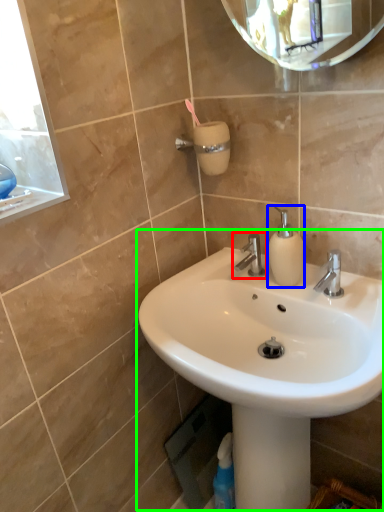
Question: Considering the real-world distances, which object is farthest from tap (highlighted by a red box)? soap dispenser (highlighted by a blue box) or sink (highlighted by a green box)?

Choices:
 (A) soap dispenser
 (B) sink

Answer: (B)